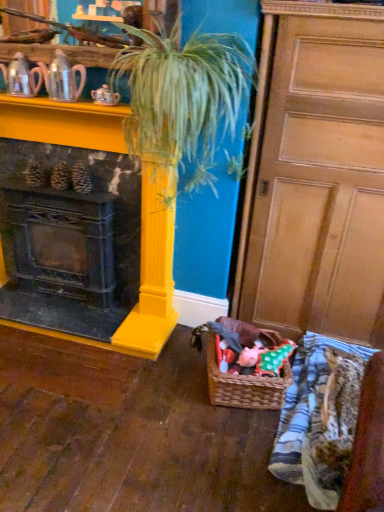
Question: From the image's perspective, is matte silver teapot at upper left, which is counted as the first tea pot, starting from the right, above or below velvety plush toy at lower center?

Choices:
 (A) below
 (B) above

Answer: (B)

Question: From a real-world perspective, is matte silver teapot at upper left, which is counted as the first tea pot, starting from the right, physically located above or below velvety plush toy at lower center?

Choices:
 (A) below
 (B) above

Answer: (B)

Question: Estimate the real-world distances between objects in this image. Which object is closer to the black cast iron fireplace at left?

Choices:
 (A) striped cotton blanket at lower right
 (B) matte silver teapot at upper left, which is counted as the first tea pot, starting from the right
 (C) woven brown basket at lower center
 (D) green leafy plant at center
 (E) metallic silver teapot at left, the 1th tea pot viewed from the left

Answer: (D)

Question: Which is nearer to the wooden at center?

Choices:
 (A) black cast iron fireplace at left
 (B) velvety plush toy at lower center
 (C) green leafy plant at center
 (D) woven brown basket at lower center
 (E) matte silver teapot at upper left, marked as the 2th tea pot in a left-to-right arrangement

Answer: (C)